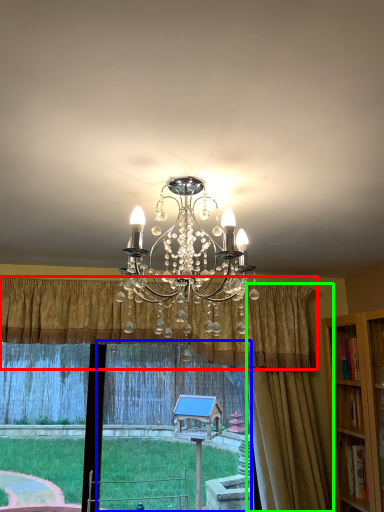
Question: Considering the real-world distances, which object is closest to curtain (highlighted by a red box)? window frame (highlighted by a blue box) or curtain (highlighted by a green box).

Choices:
 (A) window frame
 (B) curtain

Answer: (B)